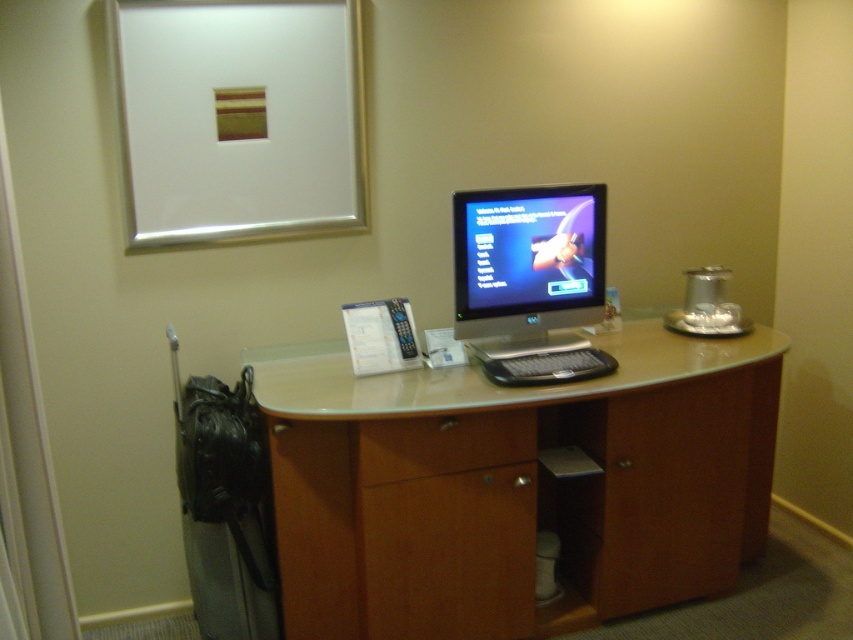
You are setting up a new monitor on the wooden computer desk at center and need to place a silver metallic picture frame at upper center on the desk. Considering the desk and frame sizes, can the frame fit on the desk without overlapping the edges?

The wooden computer desk at center is wider than the silver metallic picture frame at upper center, so the frame should fit without overlapping the edges.

You are organizing the desk and need to place a new item between the silver metallic picture frame at upper center and the wooden drawer at center. Considering their sizes, which object should you place closer to the edge of the desk to ensure stability?

The wooden drawer at center should be placed closer to the edge of the desk because it is smaller than the silver metallic picture frame at upper center, making it easier to position securely without overbalancing.

You are organizing the desk and need to place a new item between the silver metallic picture frame at upper center and the wooden drawer at center. Based on their widths, which object should you place closer to the edge of the desk to ensure the new item fits?

The silver metallic picture frame at upper center might be wider than the wooden drawer at center, so placing the wider frame closer to the edge would allow more space for the new item between them.